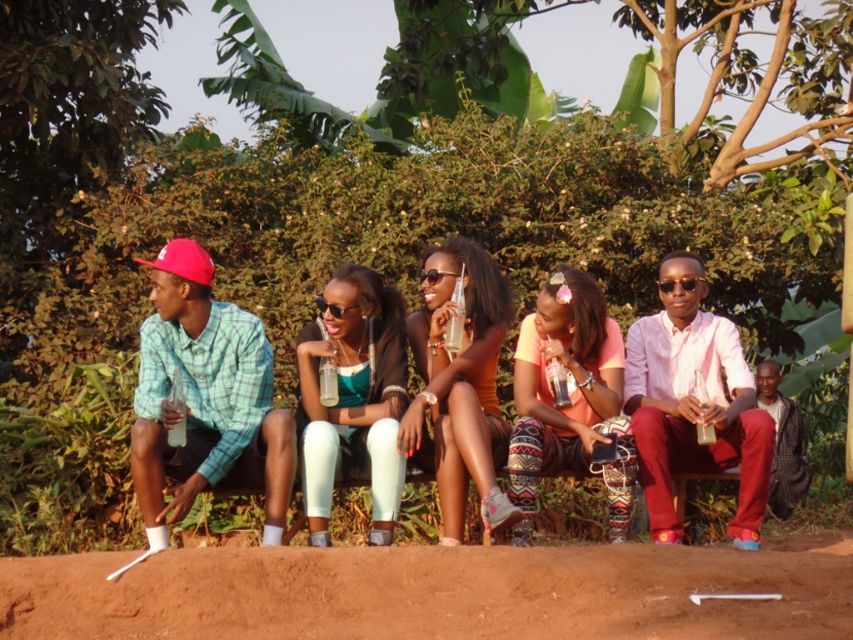
Question: Does brown dirt track at lower center have a greater width compared to matte orange tank top at center?

Choices:
 (A) yes
 (B) no

Answer: (A)

Question: Which point is closer to the camera?

Choices:
 (A) (502, 460)
 (B) (392, 388)
 (C) (202, 628)

Answer: (C)

Question: Can you confirm if brown dirt track at lower center is bigger than teal leggings at center?

Choices:
 (A) no
 (B) yes

Answer: (B)

Question: Which point appears farthest from the camera in this image?

Choices:
 (A) (596, 332)
 (B) (537, 595)

Answer: (A)

Question: Where is brown dirt track at lower center located in relation to matte orange tank top at center in the image?

Choices:
 (A) above
 (B) below

Answer: (B)

Question: Which object appears farthest from the camera in this image?

Choices:
 (A) matte orange tank top at center
 (B) orange cotton shirt at center

Answer: (B)